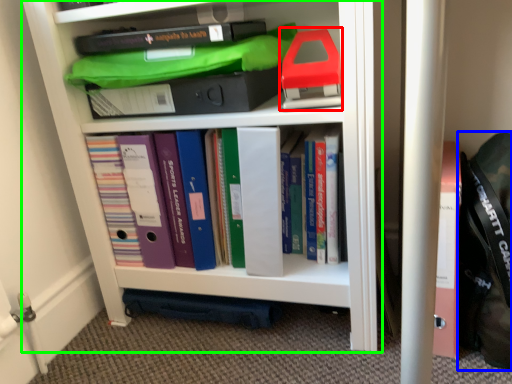
Question: Considering the real-world distances, which object is farthest from book (highlighted by a red box)? messenger bag (highlighted by a blue box) or shelf (highlighted by a green box)?

Choices:
 (A) messenger bag
 (B) shelf

Answer: (A)